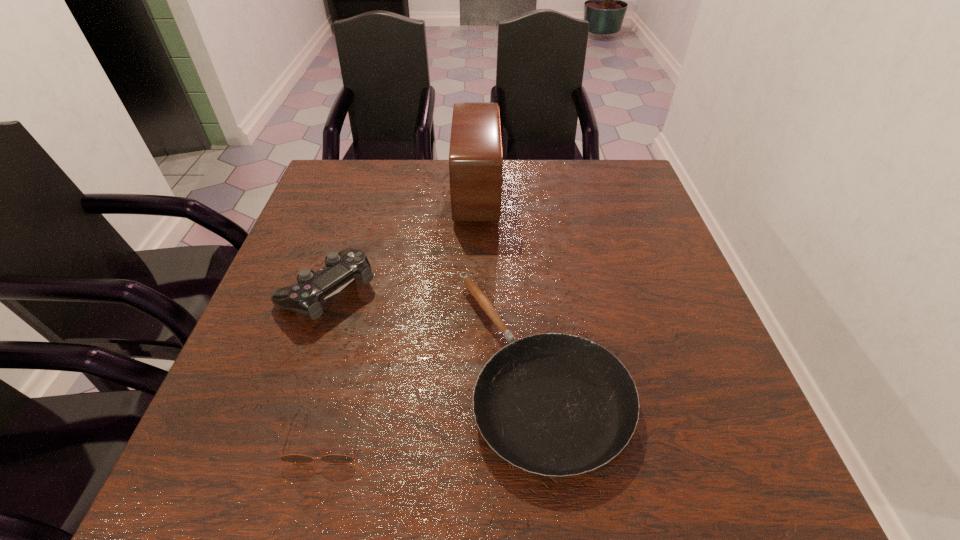
Find the location of a particular element. This screenshot has height=540, width=960. radio receiver is located at coordinates (475, 155).

Identify the location of the farthest object. (475, 155).

You are a GUI agent. You are given a task and a screenshot of the screen. Output one action in this format:
    pyautogui.click(x=<x>, y=<y>)
    Task: Click on the second tallest object
    The height and width of the screenshot is (540, 960).
    Given the screenshot: What is the action you would take?
    pyautogui.click(x=306, y=297)

Where is `the second shortest object`? the second shortest object is located at coordinates (553, 404).

Where is `the shortest object`? the shortest object is located at coordinates (293, 458).

Locate an element on the screen. The width and height of the screenshot is (960, 540). vacant region located 0.260m on the front-facing side of the tallest object is located at coordinates (590, 194).

This screenshot has width=960, height=540. Identify the location of free space located on the back of the control. (350, 222).

I want to click on vacant region located on the back of the frying pan, so click(522, 217).

You are a GUI agent. You are given a task and a screenshot of the screen. Output one action in this format:
    pyautogui.click(x=<x>, y=<y>)
    Task: Click on the vacant region located 0.050m on the face of the shortest object
    
    Given the screenshot: What is the action you would take?
    pyautogui.click(x=311, y=496)

Image resolution: width=960 pixels, height=540 pixels. What are the coordinates of `object located at the far edge` in the screenshot? It's located at (475, 155).